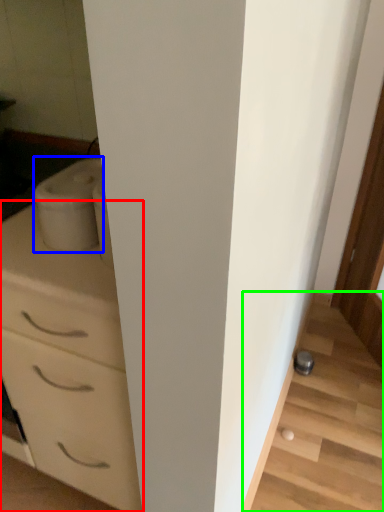
Question: Estimate the real-world distances between objects in this image. Which object is closer to chest of drawers (highlighted by a red box), appliance (highlighted by a blue box) or stairwell (highlighted by a green box)?

Choices:
 (A) appliance
 (B) stairwell

Answer: (A)